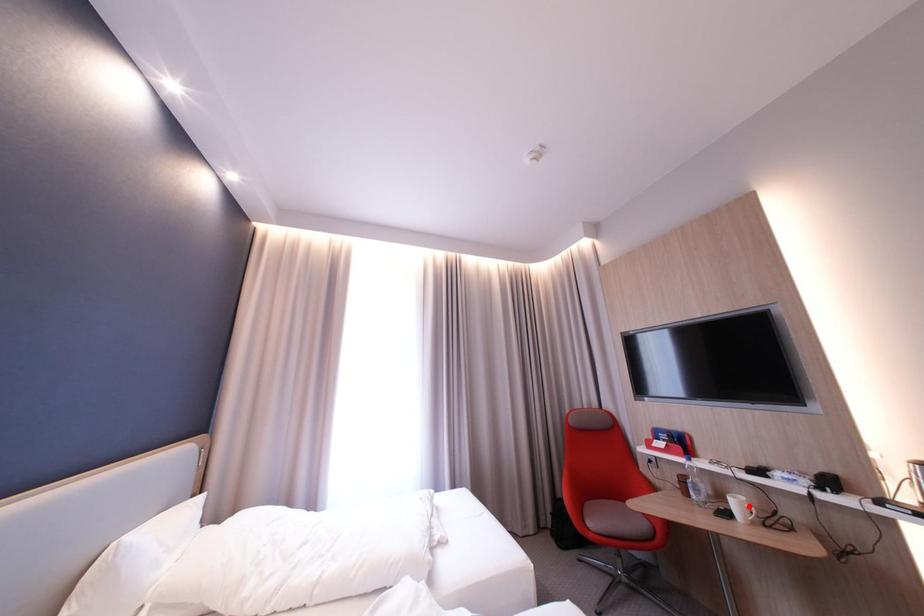
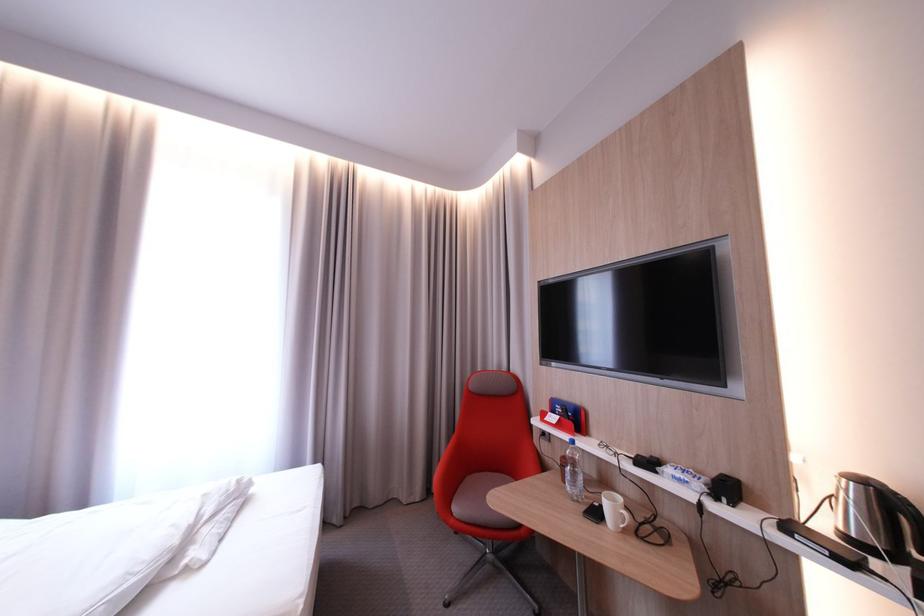
Question: I am providing you with two images of the same scene from different viewpoints. Given a red point in image1, look at the same physical point in image2. Is it:

Choices:
 (A) Closer to the viewpoint
 (B) Farther from the viewpoint

Answer: (B)